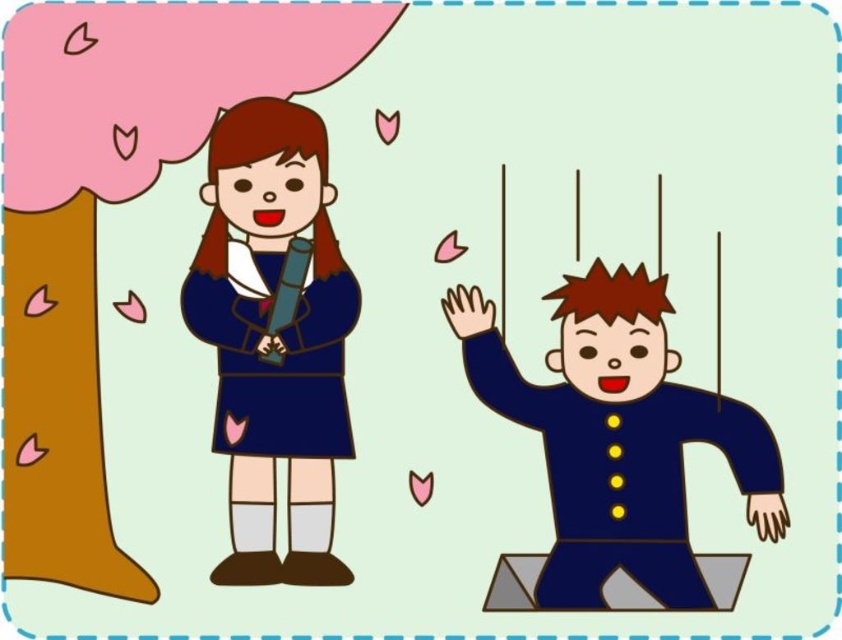
You are standing in front of the image and want to reach the matte blue dress at center. If your hand can extend 1.2 meters, will you be able to touch it?

The matte blue dress at center is 1.32 meters away from the viewer, which is farther than the hand can extend 1.2 meters. Therefore, you cannot touch it.

You are a fashion designer observing the image. You need to decide which piece of clothing is taller between the matte blue dress at center and the matte blue uniform at right. Which one is taller?

The matte blue dress at center is much taller than the matte blue uniform at right.

You are a photographer standing in front of the scene. You want to take a photo that includes both the girl and the tree trunk. The girl is at point (253, 504) and the tree trunk is at point (568, 448). Which point is closer to your camera so that you can focus on it first?

Point (253, 504) is closer to the camera than point (568, 448), so you should focus on the girl first.